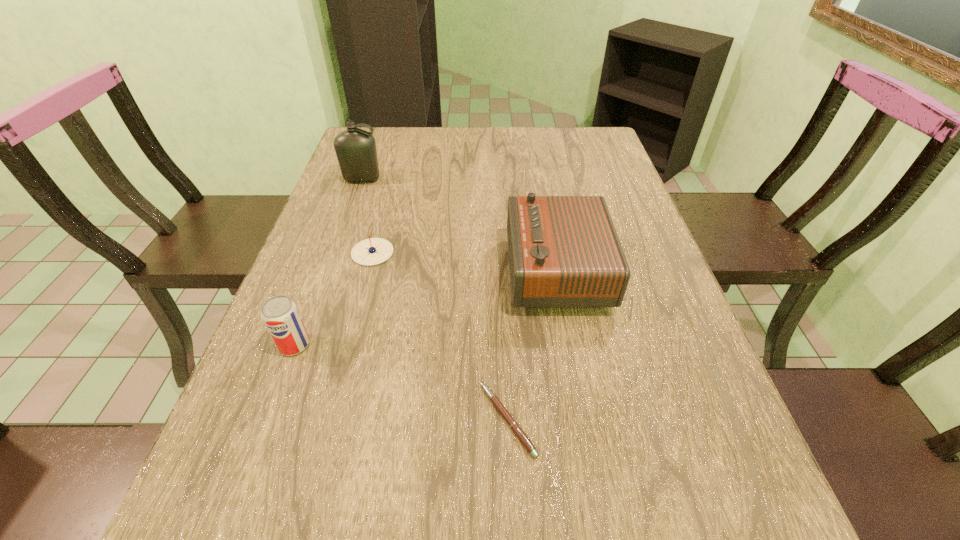
The width and height of the screenshot is (960, 540). What are the coordinates of `free space located on the front panel of the fourth shortest object` in the screenshot? It's located at (461, 271).

The width and height of the screenshot is (960, 540). In order to click on vacant space located 0.100m on the front panel of the fourth shortest object in this screenshot , I will do `click(466, 271)`.

This screenshot has width=960, height=540. In order to click on free location located 0.120m on the right of the third shortest object in this screenshot , I will do `click(371, 345)`.

Locate an element on the screen. Image resolution: width=960 pixels, height=540 pixels. blank space located 0.340m on the front of the second shortest object is located at coordinates (334, 395).

What are the coordinates of `vacant region located 0.170m at the nib of the shortest object` in the screenshot? It's located at (381, 419).

Locate an element on the screen. This screenshot has height=540, width=960. vacant point located at the nib of the shortest object is located at coordinates (398, 419).

Where is `free space located at the nib of the shortest object`? Image resolution: width=960 pixels, height=540 pixels. free space located at the nib of the shortest object is located at coordinates (357, 419).

The image size is (960, 540). Identify the location of bottle that is at the left edge. (355, 148).

This screenshot has width=960, height=540. In order to click on soda at the left edge in this screenshot , I will do point(279,313).

This screenshot has width=960, height=540. Identify the location of compass that is at the left edge. (373, 251).